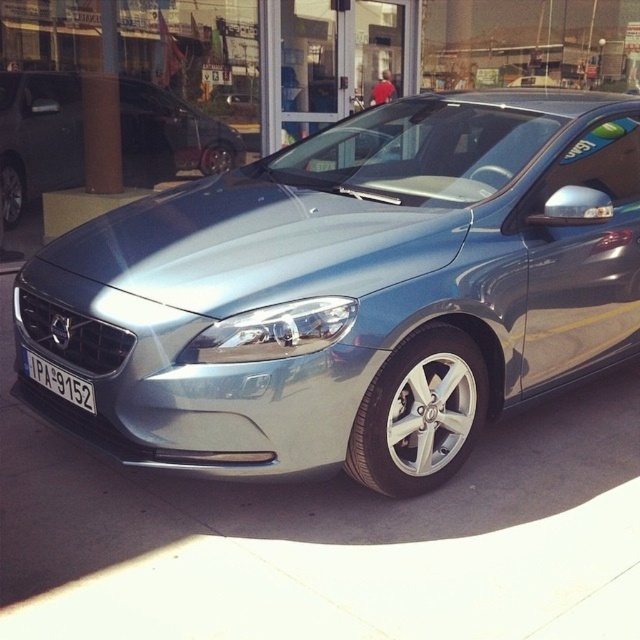
You are a delivery person trying to park a new car that is exactly the same size as the satin metallic car at center. The parking spot you want to use has a maximum width limit of 2 meters. The white plastic license plate at center is 0.3 meters wide. Can your car fit in the parking spot?

The satin metallic car at center might be wider than the white plastic license plate at center, which is 0.3 meters wide. Since the car could be wider than 0.3 meters and the parking spot has a maximum width limit of 2 meters, the car should fit as long as its width does not exceed 2 meters. However, without knowing the exact width of the car, we cannot confirm for certain.

You are a photographer trying to capture the reflection of the satin metallic car at center on the glass storefront behind it. However, the white plastic license plate at center is blocking part of the reflection. Can you determine which object is taller so you know which one to adjust to avoid the blockage?

The satin metallic car at center is taller than the white plastic license plate at center, so adjusting the angle to focus on the taller satin metallic car at center would avoid the blockage from the shorter license plate.

In the scene shown: You are a photographer trying to capture the reflection of the satin metallic car at center and the satin silver car at center in the glass storefront. Which car will have its reflection closer to the bottom of the glass?

The satin metallic car at center is positioned under the satin silver car at center, so its reflection will be closer to the bottom of the glass.